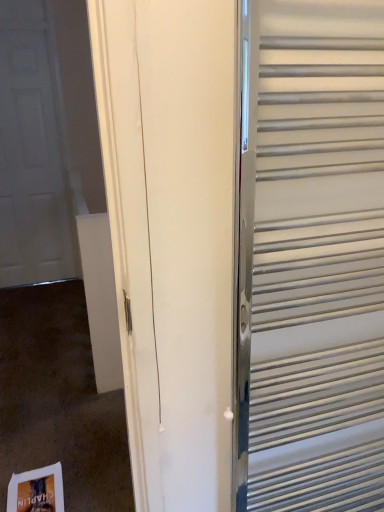
Question: Considering the relative positions of white matte door at left and metallic silver elevator at right in the image provided, is white matte door at left to the left of metallic silver elevator at right from the viewer's perspective?

Choices:
 (A) no
 (B) yes

Answer: (B)

Question: Does white matte door at left have a lesser height compared to metallic silver elevator at right?

Choices:
 (A) no
 (B) yes

Answer: (A)

Question: Is white matte door at left positioned before metallic silver elevator at right?

Choices:
 (A) yes
 (B) no

Answer: (B)

Question: Considering the relative sizes of white matte door at left and metallic silver elevator at right in the image provided, is white matte door at left bigger than metallic silver elevator at right?

Choices:
 (A) no
 (B) yes

Answer: (B)

Question: Is white matte door at left located outside metallic silver elevator at right?

Choices:
 (A) no
 (B) yes

Answer: (B)

Question: From the image's perspective, would you say white matte door at left is shown under metallic silver elevator at right?

Choices:
 (A) no
 (B) yes

Answer: (A)

Question: Considering the relative sizes of metallic silver elevator at right and white matte door at left in the image provided, is metallic silver elevator at right thinner than white matte door at left?

Choices:
 (A) yes
 (B) no

Answer: (B)

Question: Is metallic silver elevator at right shorter than white matte door at left?

Choices:
 (A) yes
 (B) no

Answer: (A)

Question: Would you say metallic silver elevator at right contains white matte door at left?

Choices:
 (A) no
 (B) yes

Answer: (A)

Question: Is metallic silver elevator at right to the right of white matte door at left from the viewer's perspective?

Choices:
 (A) yes
 (B) no

Answer: (A)

Question: From the image's perspective, would you say metallic silver elevator at right is positioned over white matte door at left?

Choices:
 (A) yes
 (B) no

Answer: (B)

Question: Can you confirm if metallic silver elevator at right is smaller than white matte door at left?

Choices:
 (A) yes
 (B) no

Answer: (A)

Question: Considering the positions of point (66, 258) and point (324, 94), is point (66, 258) closer or farther from the camera than point (324, 94)?

Choices:
 (A) closer
 (B) farther

Answer: (B)